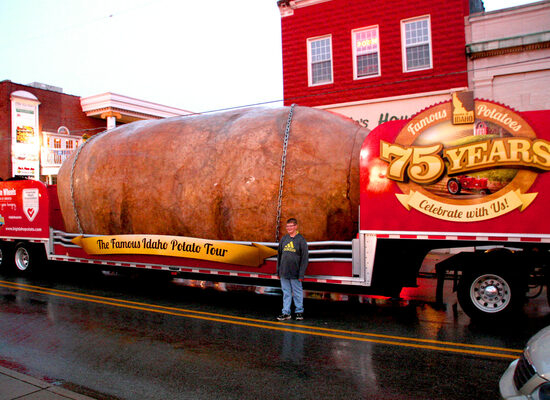
Identify the location of windows. (364, 39), (415, 33), (314, 45).